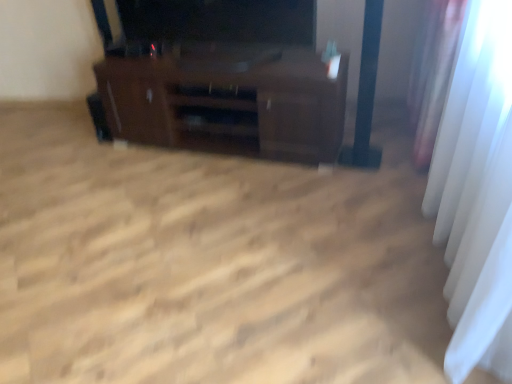
What do you see at coordinates (228, 101) in the screenshot? The image size is (512, 384). I see `dark brown wood tv stand at center` at bounding box center [228, 101].

Where is `dark brown wood tv stand at center`? This screenshot has width=512, height=384. dark brown wood tv stand at center is located at coordinates (228, 101).

This screenshot has height=384, width=512. In order to click on white sheer curtain at right in this screenshot , I will do `click(477, 194)`.

The image size is (512, 384). What do you see at coordinates (477, 194) in the screenshot? I see `white sheer curtain at right` at bounding box center [477, 194].

Identify the location of dark brown wood tv stand at center. The image size is (512, 384). (228, 101).

Is dark brown wood tv stand at center at the right side of white sheer curtain at right?

No.

Is dark brown wood tv stand at center in front of white sheer curtain at right?

No, it is behind white sheer curtain at right.

Is point (303, 135) closer or farther from the camera than point (457, 271)?

Point (303, 135).

From the image's perspective, which is below, dark brown wood tv stand at center or white sheer curtain at right?

white sheer curtain at right, from the image's perspective.

From a real-world perspective, is dark brown wood tv stand at center located beneath white sheer curtain at right?

Indeed, from a real-world perspective, dark brown wood tv stand at center is positioned beneath white sheer curtain at right.

Which object is wider, dark brown wood tv stand at center or white sheer curtain at right?

dark brown wood tv stand at center is wider.

Who is shorter, dark brown wood tv stand at center or white sheer curtain at right?

With less height is dark brown wood tv stand at center.

Who is bigger, dark brown wood tv stand at center or white sheer curtain at right?

white sheer curtain at right is bigger.

Based on the photo, choose the correct answer: Is dark brown wood tv stand at center inside white sheer curtain at right or outside it?

dark brown wood tv stand at center is not enclosed by white sheer curtain at right.

Is there a large distance between dark brown wood tv stand at center and white sheer curtain at right?

dark brown wood tv stand at center is positioned a significant distance from white sheer curtain at right.

Could you tell me if dark brown wood tv stand at center is facing white sheer curtain at right?

No, dark brown wood tv stand at center does not turn towards white sheer curtain at right.

Where is `furniture that appears below the white sheer curtain at right (from a real-world perspective)`? This screenshot has height=384, width=512. furniture that appears below the white sheer curtain at right (from a real-world perspective) is located at coordinates (228, 101).

Can you confirm if white sheer curtain at right is positioned to the left of dark brown wood tv stand at center?

In fact, white sheer curtain at right is to the right of dark brown wood tv stand at center.

Is white sheer curtain at right closer to the viewer compared to dark brown wood tv stand at center?

Yes, the depth of white sheer curtain at right is less than that of dark brown wood tv stand at center.

Between point (493, 335) and point (197, 110), which one is positioned behind?

The point (197, 110) is behind.

From the image's perspective, is white sheer curtain at right above dark brown wood tv stand at center?

No, from the image's perspective, white sheer curtain at right is not on top of dark brown wood tv stand at center.

From a real-world perspective, is white sheer curtain at right positioned under dark brown wood tv stand at center based on gravity?

Actually, white sheer curtain at right is physically above dark brown wood tv stand at center in the real world.

Which object is wider, white sheer curtain at right or dark brown wood tv stand at center?

dark brown wood tv stand at center is wider.

Considering the relative sizes of white sheer curtain at right and dark brown wood tv stand at center in the image provided, is white sheer curtain at right shorter than dark brown wood tv stand at center?

No.

Based on the photo, considering the sizes of objects white sheer curtain at right and dark brown wood tv stand at center in the image provided, who is bigger, white sheer curtain at right or dark brown wood tv stand at center?

Bigger between the two is white sheer curtain at right.

Is white sheer curtain at right positioned beyond the bounds of dark brown wood tv stand at center?

Yes.

Does white sheer curtain at right touch dark brown wood tv stand at center?

white sheer curtain at right and dark brown wood tv stand at center are not in contact.

Is white sheer curtain at right facing away from dark brown wood tv stand at center?

No, white sheer curtain at right's orientation is not away from dark brown wood tv stand at center.

Can you tell me how much white sheer curtain at right and dark brown wood tv stand at center differ in facing direction?

white sheer curtain at right and dark brown wood tv stand at center are facing 81.5 degrees away from each other.

I want to click on curtain in front of the dark brown wood tv stand at center, so click(477, 194).

The width and height of the screenshot is (512, 384). Identify the location of curtain on the right of dark brown wood tv stand at center. tap(477, 194).

This screenshot has width=512, height=384. What are the coordinates of `furniture to the left of white sheer curtain at right` in the screenshot? It's located at (228, 101).